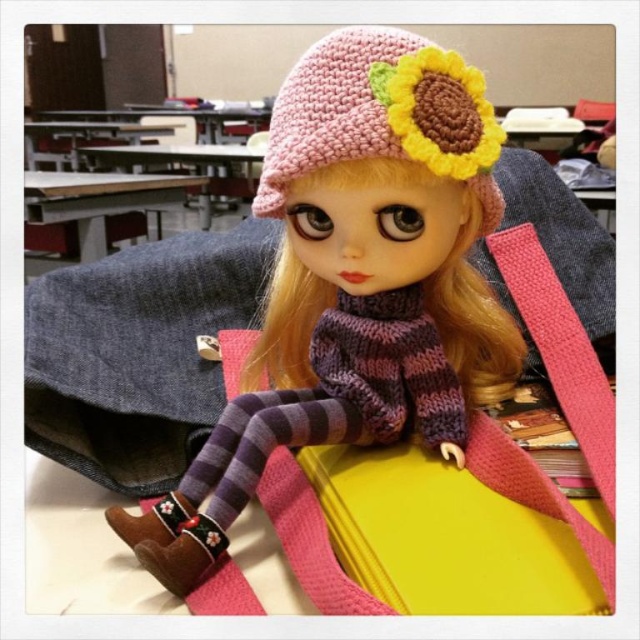
Can you confirm if knitted pink hat at upper center is smaller than pink knitted hat at upper center?

No.

Who is positioned more to the left, knitted pink hat at upper center or pink knitted hat at upper center?

Positioned to the left is knitted pink hat at upper center.

Between point (317, 160) and point (394, 72), which one is positioned behind?

The point (317, 160) is more distant.

Where is `knitted pink hat at upper center`? Image resolution: width=640 pixels, height=640 pixels. knitted pink hat at upper center is located at coordinates (353, 275).